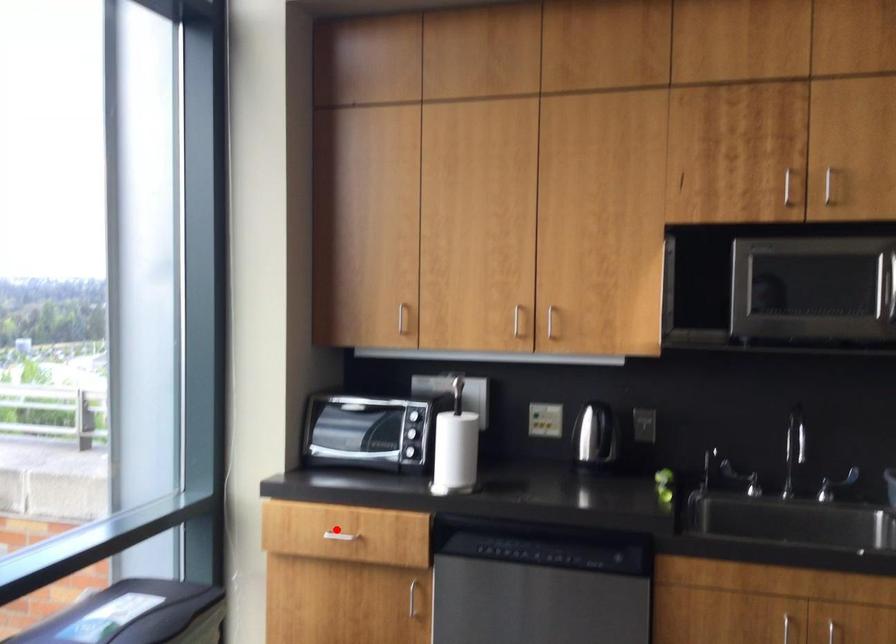
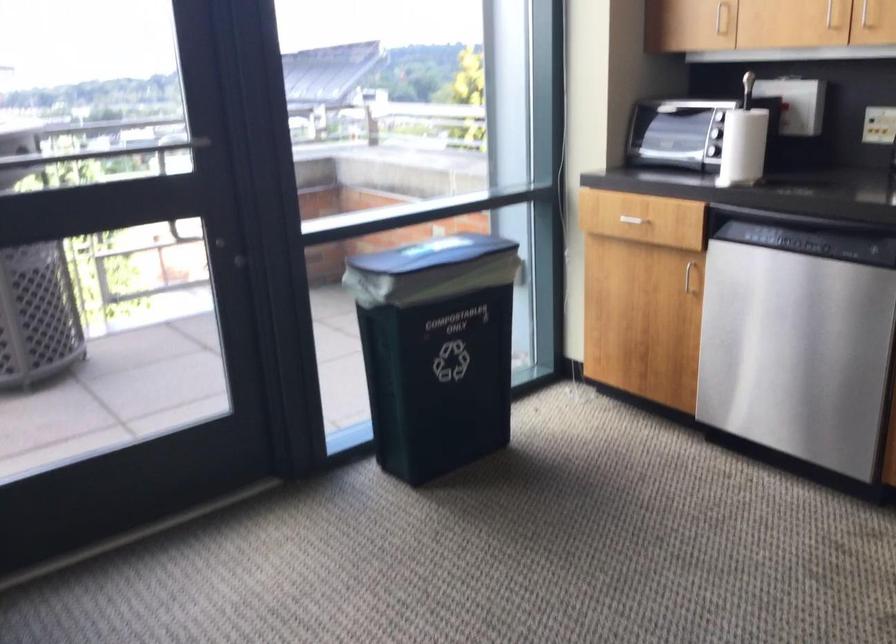
Where in the second image is the point corresponding to the highlighted location from the first image?

(633, 214)